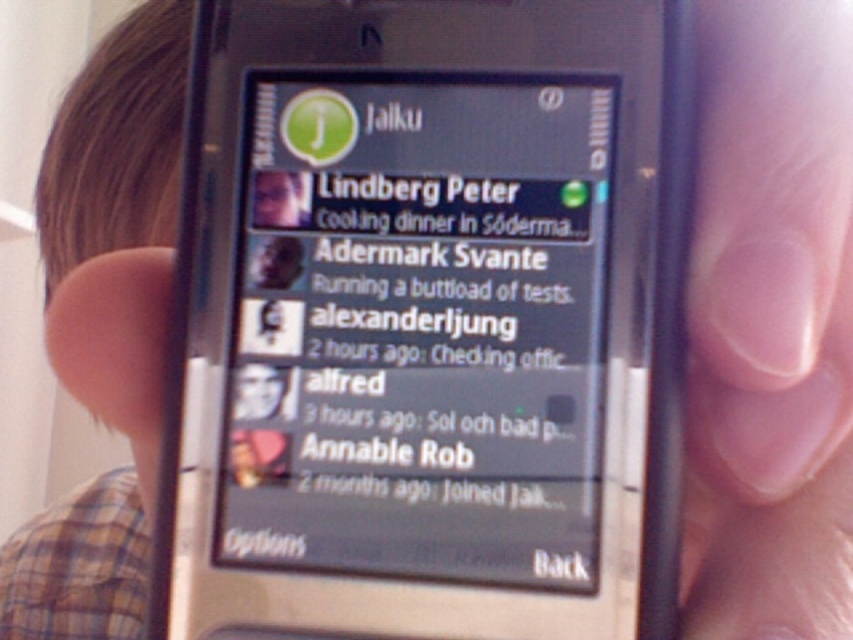
Question: Can you confirm if matte black phone screen at center is thinner than matte black phone at center?

Choices:
 (A) yes
 (B) no

Answer: (B)

Question: Can you confirm if matte black phone screen at center is positioned to the left of matte black phone at center?

Choices:
 (A) yes
 (B) no

Answer: (A)

Question: Which point appears closest to the camera in this image?

Choices:
 (A) (277, 113)
 (B) (454, 465)

Answer: (B)

Question: Is matte black phone screen at center wider than matte black phone at center?

Choices:
 (A) no
 (B) yes

Answer: (B)